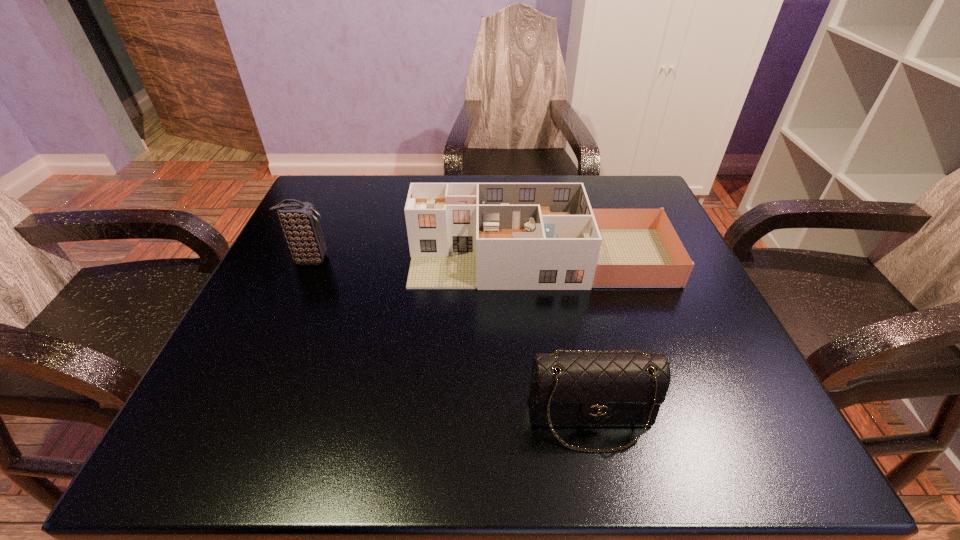
The image size is (960, 540). I want to click on object that is at the left edge, so click(x=299, y=220).

The image size is (960, 540). I want to click on object situated at the right edge, so click(488, 236).

The height and width of the screenshot is (540, 960). Find the location of `free space at the far edge of the desktop`. free space at the far edge of the desktop is located at coordinates (399, 199).

In the image, there is a desktop. Where is `vacant space at the near edge`? The height and width of the screenshot is (540, 960). vacant space at the near edge is located at coordinates (343, 434).

Image resolution: width=960 pixels, height=540 pixels. Find the location of `free space at the left edge of the desktop`. free space at the left edge of the desktop is located at coordinates (265, 276).

The height and width of the screenshot is (540, 960). Find the location of `vacant region at the right edge of the desktop`. vacant region at the right edge of the desktop is located at coordinates (641, 315).

Locate an element on the screen. This screenshot has width=960, height=540. vacant position at the far right corner of the desktop is located at coordinates (622, 189).

Where is `free area in between the leftmost object and the right clutch bag`? free area in between the leftmost object and the right clutch bag is located at coordinates (450, 339).

Where is `vacant space in between the dollhouse and the nearer clutch bag`? This screenshot has height=540, width=960. vacant space in between the dollhouse and the nearer clutch bag is located at coordinates (565, 338).

Find the location of a particular element. This screenshot has height=540, width=960. vacant point located between the nearest object and the taller clutch bag is located at coordinates (450, 339).